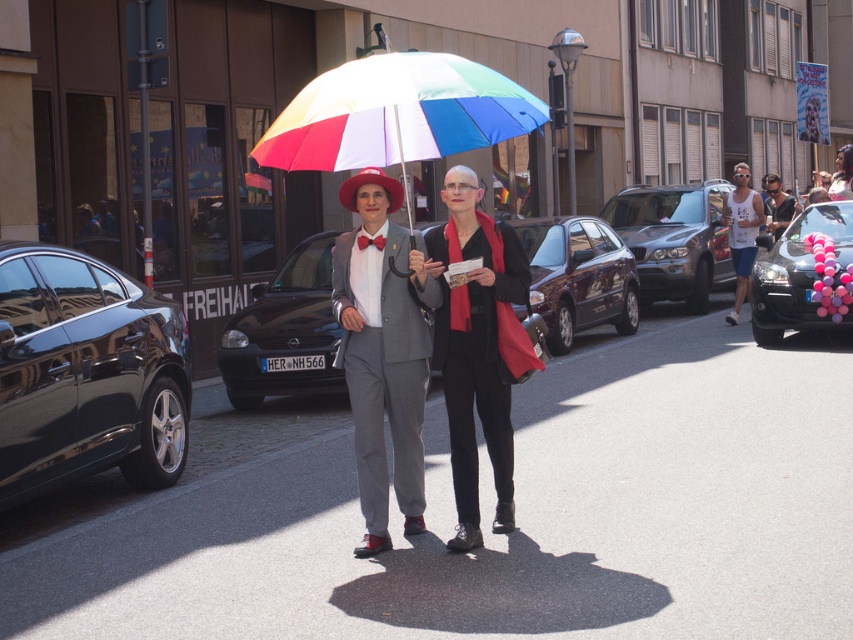
Question: Does shiny dark brown hatchback at center appear on the left side of pink balloon-decorated car at right?

Choices:
 (A) no
 (B) yes

Answer: (B)

Question: Estimate the real-world distances between objects in this image. Which object is closer to the pink balloon-decorated car at right?

Choices:
 (A) rainbow fabric umbrella at center
 (B) glossy black car at left

Answer: (A)

Question: Which of the following is the farthest from the observer?

Choices:
 (A) black matte scarf at center
 (B) matte black tank top at center
 (C) shiny dark brown hatchback at center

Answer: (B)

Question: Can you confirm if metallic silver suv at center is bigger than matte black tank top at center?

Choices:
 (A) yes
 (B) no

Answer: (A)

Question: Is pink balloon-decorated car at right to the right of matte black tank top at center from the viewer's perspective?

Choices:
 (A) no
 (B) yes

Answer: (A)

Question: Which of the following is the farthest from the observer?

Choices:
 (A) rainbow fabric umbrella at center
 (B) black matte scarf at center

Answer: (B)